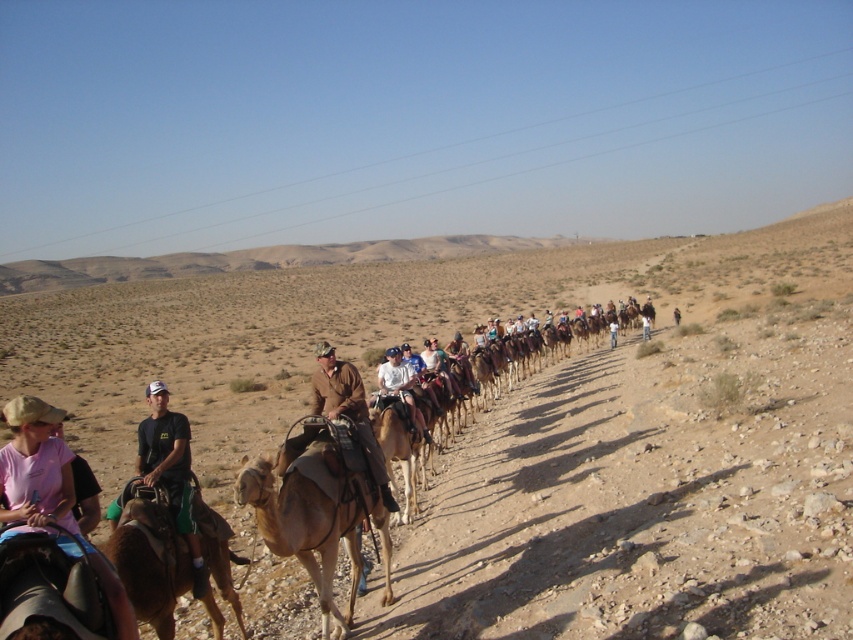
Question: Can you confirm if brown sandy desert at center is positioned below white cotton shirt at center?

Choices:
 (A) no
 (B) yes

Answer: (A)

Question: Which object is the closest to the brown suede jacket at center?

Choices:
 (A) white cotton shirt at center
 (B) light brown leather camel at center
 (C) brown sandy desert at center
 (D) pink fabric shirt at lower left

Answer: (B)

Question: Can you confirm if light brown leather camel at center is smaller than brown fuzzy camel at lower left?

Choices:
 (A) no
 (B) yes

Answer: (A)

Question: Which point appears closest to the camera in this image?

Choices:
 (A) pos(366,436)
 (B) pos(761,404)
 (C) pos(9,420)

Answer: (C)

Question: Does light brown leather camel at center come in front of brown fuzzy camel at lower left?

Choices:
 (A) no
 (B) yes

Answer: (B)

Question: Which point is farther from the camera taking this photo?

Choices:
 (A) (320, 577)
 (B) (138, 436)
 (C) (367, 448)
 (D) (39, 413)

Answer: (C)